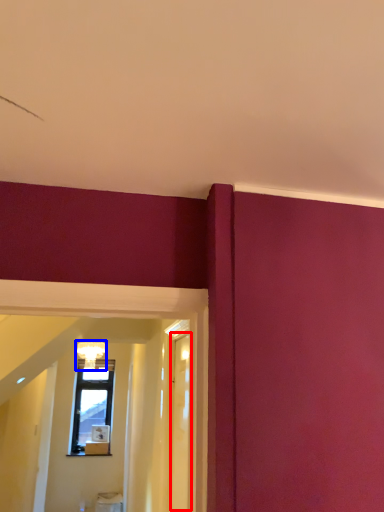
Question: Which object is closer to the camera taking this photo, glass door (highlighted by a red box) or light fixture (highlighted by a blue box)?

Choices:
 (A) glass door
 (B) light fixture

Answer: (A)